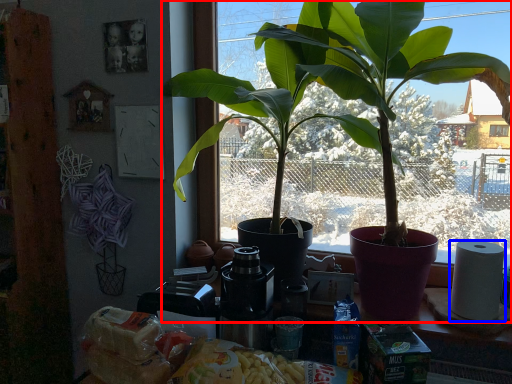
Question: Which object appears closest to the camera in this image, houseplant (highlighted by a red box) or paper towel (highlighted by a blue box)?

Choices:
 (A) houseplant
 (B) paper towel

Answer: (A)